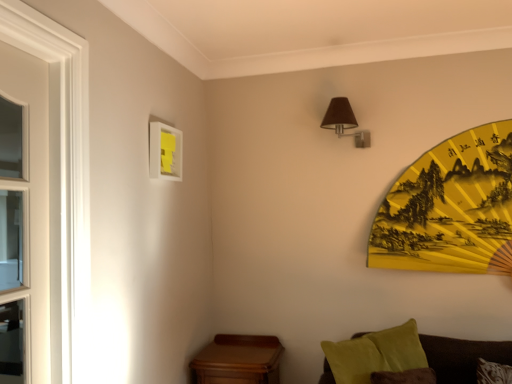
What is the approximate width of wooden table at lower left?

It is 41.86 centimeters.

Locate an element on the screen. This screenshot has width=512, height=384. wooden table at lower left is located at coordinates (238, 360).

Based on the photo, in order to face white matte picture frame at upper left, should I rotate leftwards or rightwards?

You should rotate left by 11.563 degrees.

Find the location of a particular element. The height and width of the screenshot is (384, 512). wooden table at lower left is located at coordinates pos(238,360).

From the image's perspective, is yellow paper fan at upper right positioned above or below brown fabric lampshade at upper right?

Based on their image positions, yellow paper fan at upper right is located beneath brown fabric lampshade at upper right.

Is brown fabric lampshade at upper right located within yellow paper fan at upper right?

Definitely not — brown fabric lampshade at upper right is not inside yellow paper fan at upper right.

Is yellow paper fan at upper right further to camera compared to brown fabric lampshade at upper right?

No, yellow paper fan at upper right is closer to the viewer.

From their relative heights in the image, would you say yellow paper fan at upper right is taller or shorter than brown fabric lampshade at upper right?

In the image, yellow paper fan at upper right appears to be taller than brown fabric lampshade at upper right.

Looking at their sizes, would you say yellow paper fan at upper right is wider or thinner than wooden table at lower left?

Considering their sizes, yellow paper fan at upper right looks slimmer than wooden table at lower left.

Is yellow paper fan at upper right far from wooden table at lower left?

Yes, yellow paper fan at upper right and wooden table at lower left are located far from each other.

Is wooden table at lower left completely or partially inside yellow paper fan at upper right?

No, wooden table at lower left is not a part of yellow paper fan at upper right.

How different are the orientations of yellow paper fan at upper right and wooden table at lower left in degrees?

The facing directions of yellow paper fan at upper right and wooden table at lower left are 0.383 degrees apart.

How much distance is there between wooden table at lower left and yellow paper fan at upper right?

wooden table at lower left is 1.06 meters away from yellow paper fan at upper right.

In the image, is wooden table at lower left positioned in front of or behind yellow paper fan at upper right?

wooden table at lower left is in front of yellow paper fan at upper right.

Which object is thinner, wooden table at lower left or yellow paper fan at upper right?

yellow paper fan at upper right.

From the image's perspective, which is below, wooden table at lower left or yellow paper fan at upper right?

From the image's view, wooden table at lower left is below.

From their relative heights in the image, would you say white matte picture frame at upper left is taller or shorter than brown fabric lampshade at upper right?

Clearly, white matte picture frame at upper left is taller compared to brown fabric lampshade at upper right.

How different are the orientations of white matte picture frame at upper left and brown fabric lampshade at upper right in degrees?

The facing directions of white matte picture frame at upper left and brown fabric lampshade at upper right are 91 degrees apart.

Measure the distance between white matte picture frame at upper left and brown fabric lampshade at upper right.

They are 34.69 inches apart.

Between white matte picture frame at upper left and brown fabric lampshade at upper right, which one has smaller width?

white matte picture frame at upper left is thinner.

Considering the positions of points (215, 370) and (329, 123), is point (215, 370) farther from camera compared to point (329, 123)?

No, it is in front of (329, 123).

From a real-world perspective, is wooden table at lower left located higher than brown fabric lampshade at upper right?

No, from a real-world perspective, wooden table at lower left is not over brown fabric lampshade at upper right

Would you say wooden table at lower left is a long distance from brown fabric lampshade at upper right?

Yes, wooden table at lower left is far from brown fabric lampshade at upper right.

Which of these two, wooden table at lower left or brown fabric lampshade at upper right, is thinner?

With smaller width is brown fabric lampshade at upper right.

From the image's perspective, is white matte picture frame at upper left located above wooden table at lower left?

Yes, from the image's perspective, white matte picture frame at upper left is on top of wooden table at lower left.

Would you consider white matte picture frame at upper left to be distant from wooden table at lower left?

Yes.

Is point (149, 132) closer or farther from the camera than point (229, 351)?

Point (149, 132) is closer to the camera than point (229, 351).

The width and height of the screenshot is (512, 384). I want to click on table on the right side of white matte picture frame at upper left, so click(x=238, y=360).

Considering the sizes of brown fabric lampshade at upper right and yellow paper fan at upper right in the image, is brown fabric lampshade at upper right taller or shorter than yellow paper fan at upper right?

Clearly, brown fabric lampshade at upper right is shorter compared to yellow paper fan at upper right.

Between brown fabric lampshade at upper right and yellow paper fan at upper right, which one has larger size?

Bigger between the two is yellow paper fan at upper right.

From a real-world perspective, which object stands above the other?

brown fabric lampshade at upper right is physically above.

Is point (360, 139) farther from viewer compared to point (463, 178)?

Yes, it is behind point (463, 178).

Where is `light fixture that is above the yellow paper fan at upper right (from the image's perspective)`? The width and height of the screenshot is (512, 384). light fixture that is above the yellow paper fan at upper right (from the image's perspective) is located at coordinates (344, 121).

This screenshot has height=384, width=512. Find the location of `table below the yellow paper fan at upper right (from the image's perspective)`. table below the yellow paper fan at upper right (from the image's perspective) is located at coordinates (238, 360).

Estimate the real-world distances between objects in this image. Which object is closer to white matte picture frame at upper left, wooden table at lower left or yellow paper fan at upper right?

wooden table at lower left lies closer to white matte picture frame at upper left than the other object.

Looking at the image, which one is located further to white matte picture frame at upper left, yellow paper fan at upper right or brown fabric lampshade at upper right?

yellow paper fan at upper right.

From the image, which object appears to be nearer to yellow paper fan at upper right, wooden table at lower left or brown fabric lampshade at upper right?

Among the two, brown fabric lampshade at upper right is located nearer to yellow paper fan at upper right.

From the image, which object appears to be farther from yellow paper fan at upper right, brown fabric lampshade at upper right or white matte picture frame at upper left?

white matte picture frame at upper left.

Which object lies further to the anchor point white matte picture frame at upper left, brown fabric lampshade at upper right or wooden table at lower left?

wooden table at lower left is positioned further to the anchor white matte picture frame at upper left.

Looking at the image, which one is located closer to yellow paper fan at upper right, wooden table at lower left or white matte picture frame at upper left?

wooden table at lower left.

From the image, which object appears to be nearer to yellow paper fan at upper right, white matte picture frame at upper left or brown fabric lampshade at upper right?

brown fabric lampshade at upper right.

Consider the image. Looking at the image, which one is located closer to wooden table at lower left, yellow paper fan at upper right or white matte picture frame at upper left?

white matte picture frame at upper left is positioned closer to the anchor wooden table at lower left.

Where is `design between brown fabric lampshade at upper right and wooden table at lower left vertically`? This screenshot has width=512, height=384. design between brown fabric lampshade at upper right and wooden table at lower left vertically is located at coordinates (451, 208).

I want to click on light fixture between white matte picture frame at upper left and yellow paper fan at upper right, so click(x=344, y=121).

You are a GUI agent. You are given a task and a screenshot of the screen. Output one action in this format:
    pyautogui.click(x=<x>, y=<y>)
    Task: Click on the picture frame between brown fabric lampshade at upper right and wooden table at lower left in the vertical direction
    This screenshot has height=384, width=512.
    Given the screenshot: What is the action you would take?
    pyautogui.click(x=165, y=152)

You are a GUI agent. You are given a task and a screenshot of the screen. Output one action in this format:
    pyautogui.click(x=<x>, y=<y>)
    Task: Click on the table between white matte picture frame at upper left and yellow paper fan at upper right
    The height and width of the screenshot is (384, 512).
    Given the screenshot: What is the action you would take?
    pyautogui.click(x=238, y=360)